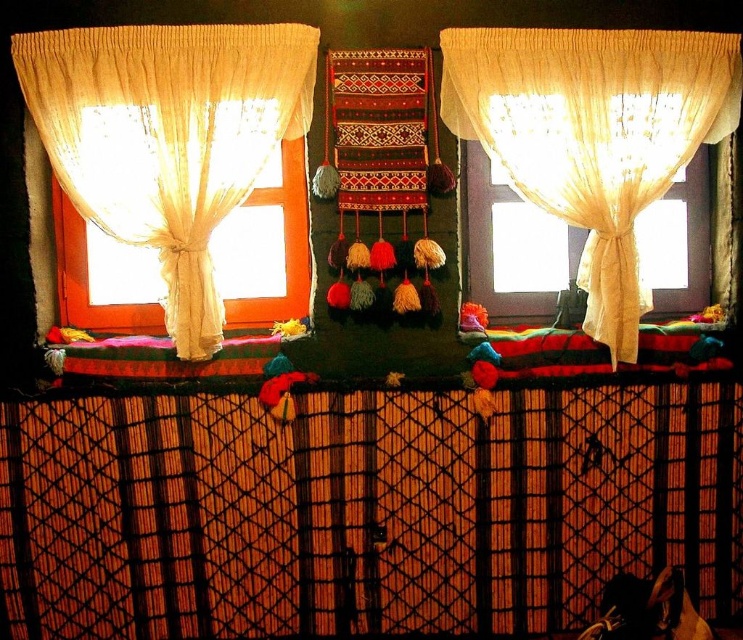
Question: Can you confirm if translucent white curtain at upper center is positioned to the left of translucent fabric at right?

Choices:
 (A) no
 (B) yes

Answer: (B)

Question: Is translucent white curtain at upper center below translucent fabric at right?

Choices:
 (A) yes
 (B) no

Answer: (B)

Question: Which point is farther to the camera?

Choices:
 (A) translucent white curtain at upper center
 (B) translucent beige fabric at left

Answer: (A)

Question: Which object appears farthest from the camera in this image?

Choices:
 (A) translucent fabric at right
 (B) translucent white curtain at upper center

Answer: (A)

Question: In this image, where is translucent beige fabric at left located relative to translucent fabric at right?

Choices:
 (A) left
 (B) right

Answer: (A)

Question: Which of the following is the closest to the observer?

Choices:
 (A) (545, 292)
 (B) (68, 177)

Answer: (B)